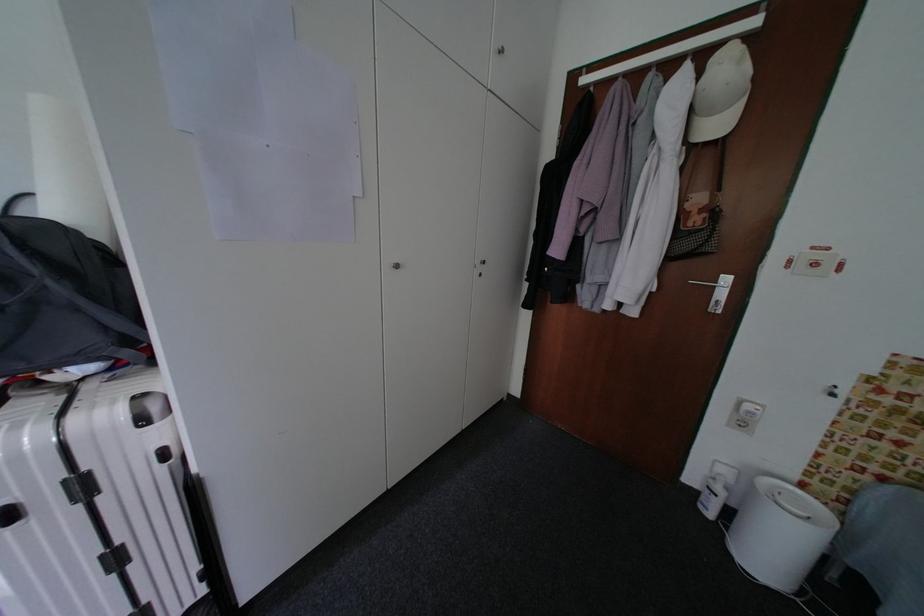
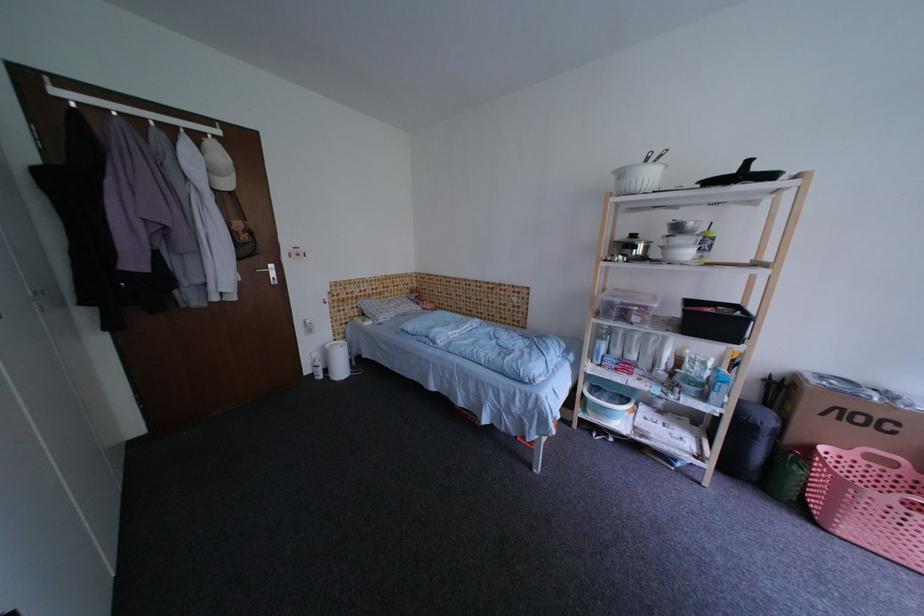
Where in the second image is the point corresponding to (737,73) from the first image?

(227, 158)